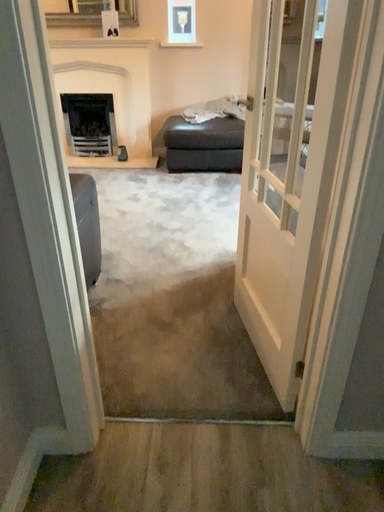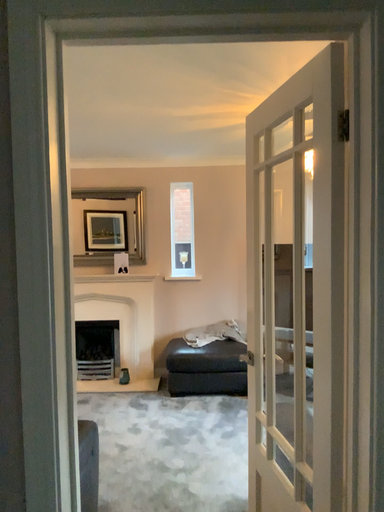
Question: Which way did the camera rotate in the video?

Choices:
 (A) rotated upward
 (B) rotated downward

Answer: (A)